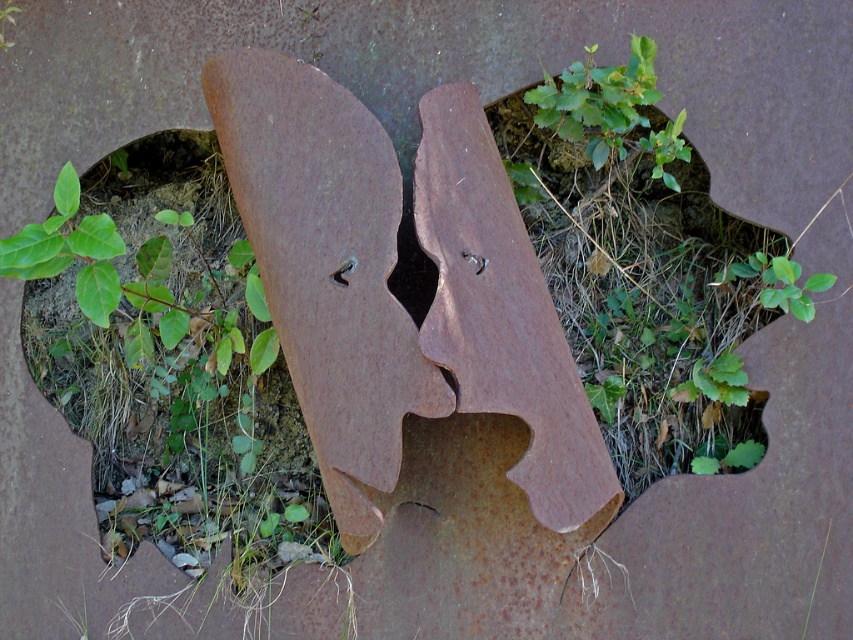
Question: Can you confirm if green leafy plant at upper center is positioned to the left of green leafy plant at center?

Choices:
 (A) yes
 (B) no

Answer: (A)

Question: Is green leafy plant at upper center closer to the viewer compared to green leafy plant at center?

Choices:
 (A) no
 (B) yes

Answer: (A)

Question: Among these objects, which one is farthest from the camera?

Choices:
 (A) green leafy plant at upper center
 (B) green leafy plant at center

Answer: (A)

Question: Among these points, which one is nearest to the camera?

Choices:
 (A) (619, 136)
 (B) (802, 298)

Answer: (B)

Question: Which of the following is the closest to the observer?

Choices:
 (A) green leafy plant at center
 (B) green leafy plant at upper center

Answer: (A)

Question: Considering the relative positions of green leafy plant at upper center and green leafy plant at center in the image provided, where is green leafy plant at upper center located with respect to green leafy plant at center?

Choices:
 (A) below
 (B) above

Answer: (B)